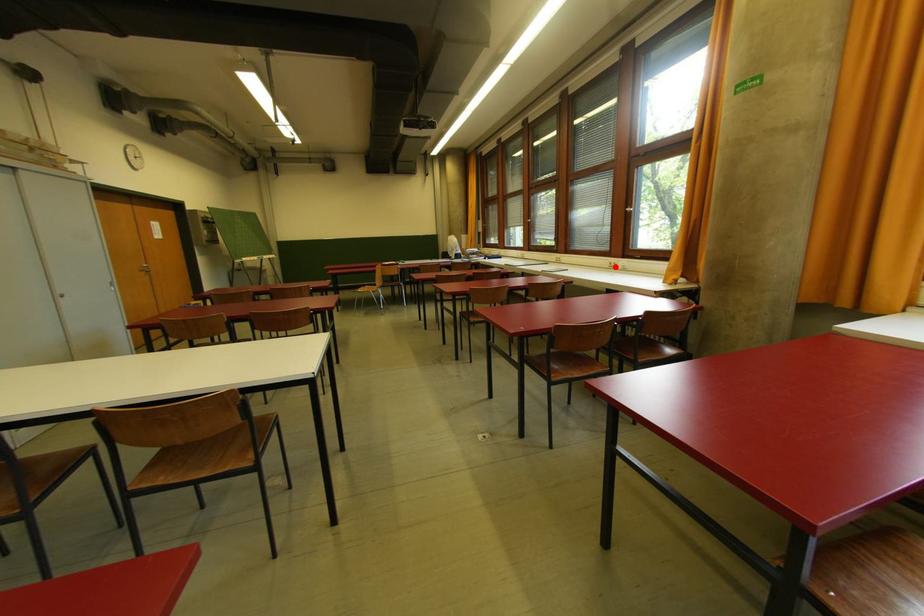
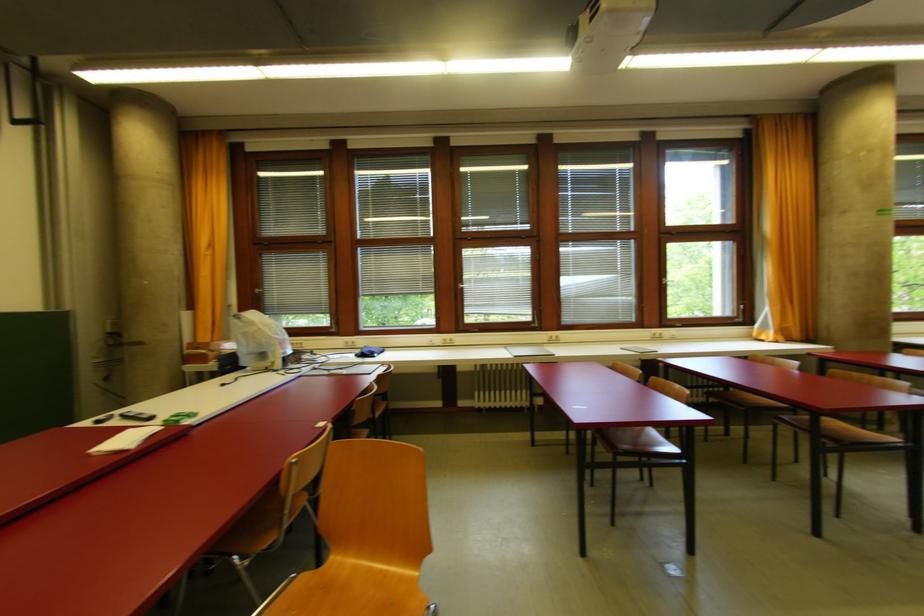
In the second image, find the point that corresponds to the highlighted location in the first image.

(660, 338)